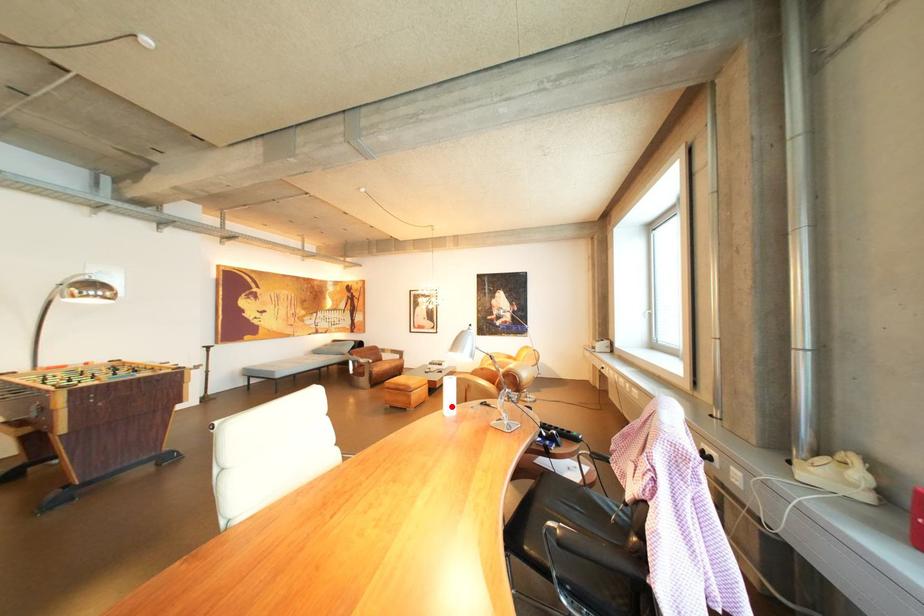
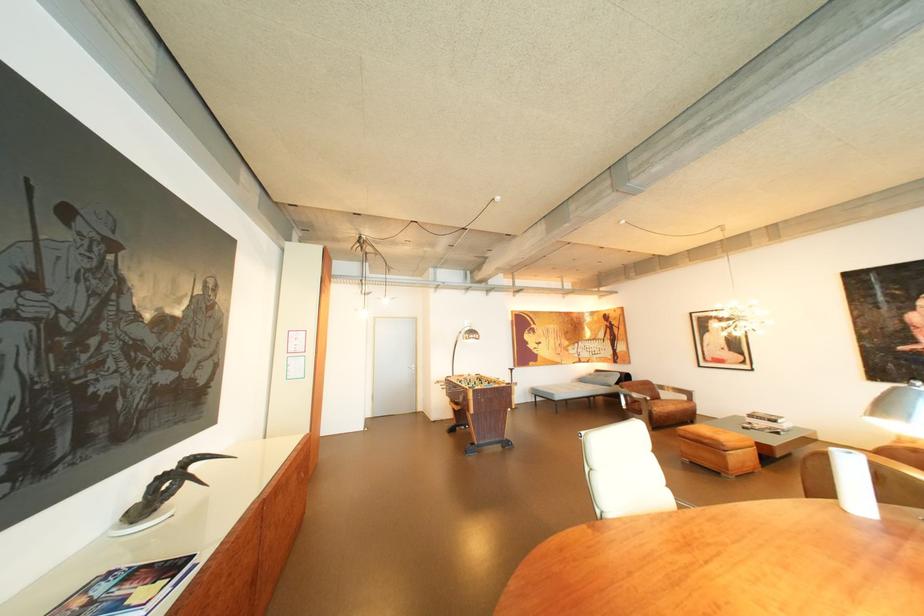
Question: I am providing you with two images of the same scene from different viewpoints. A red point is shown in image1. For the corresponding object point in image2, is it positioned nearer or farther from the camera?

Choices:
 (A) Nearer
 (B) Farther

Answer: (A)